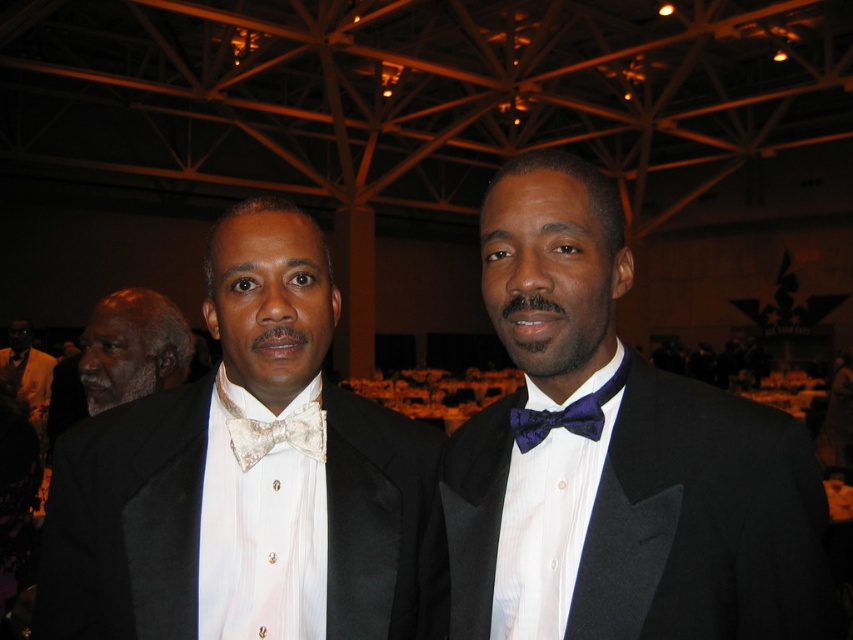
Question: Can you confirm if matte gold bow tie at center is positioned to the right of matte black suit at left?

Choices:
 (A) yes
 (B) no

Answer: (A)

Question: Which is nearer to the gray matte bow tie at upper left?

Choices:
 (A) matte gold bow tie at center
 (B) purple satin bow tie at center

Answer: (A)

Question: Among these points, which one is nearest to the camera?

Choices:
 (A) (786, 592)
 (B) (248, 572)
 (C) (582, 406)

Answer: (A)

Question: Does gray matte bow tie at upper left have a larger size compared to purple satin bow tie at center?

Choices:
 (A) yes
 (B) no

Answer: (A)

Question: Which of the following is the farthest from the observer?

Choices:
 (A) (256, 461)
 (B) (134, 310)
 (C) (38, 364)
 (D) (480, 547)

Answer: (C)

Question: Does matte black tuxedo at center come behind matte gold bow tie at center?

Choices:
 (A) yes
 (B) no

Answer: (B)